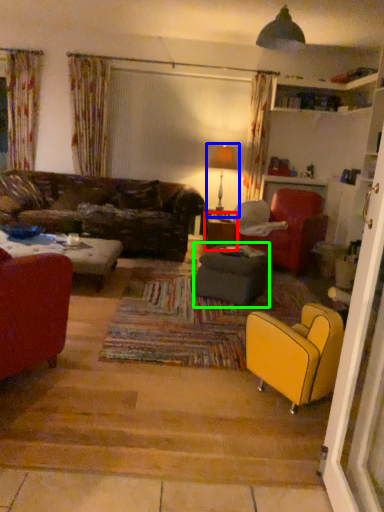
Question: Based on their relative distances, which object is nearer to table (highlighted by a red box)? Choose from lamp (highlighted by a blue box) and footrest (highlighted by a green box).

Choices:
 (A) lamp
 (B) footrest

Answer: (A)